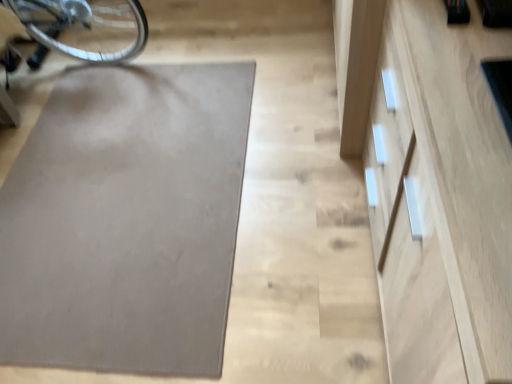
Find the location of a particular element. This screenshot has height=384, width=512. vacant space underneath matte gray yoga mat at center (from a real-world perspective) is located at coordinates (124, 188).